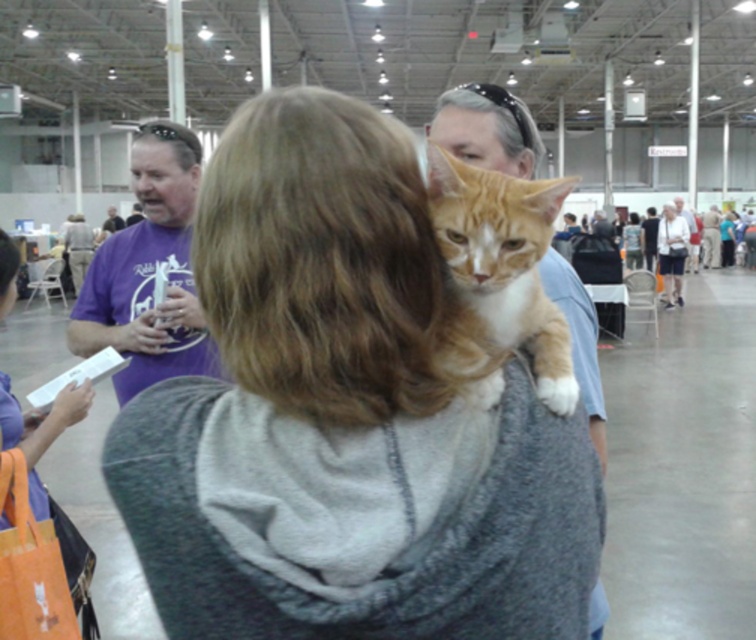
You are standing in the convention center and notice two items in the scene. One is the purple fabric bag at lower left and the other is the smooth blue shirt at upper right. Which item is positioned higher in the image?

The smooth blue shirt at upper right is positioned higher in the image than the purple fabric bag at lower left.